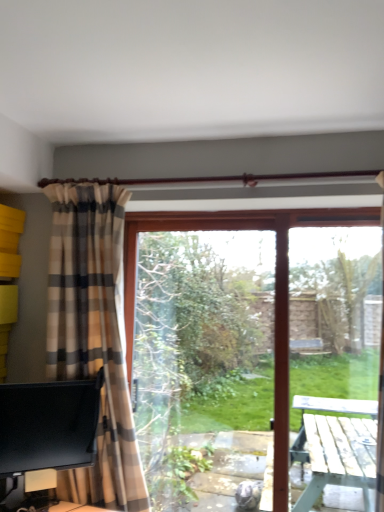
Question: Should I look upward or downward to see transparent glass screen door at right?

Choices:
 (A) down
 (B) up

Answer: (A)

Question: From the image's perspective, does plaid fabric curtain at left appear lower than transparent glass screen door at right?

Choices:
 (A) yes
 (B) no

Answer: (B)

Question: Does plaid fabric curtain at left appear on the right side of transparent glass screen door at right?

Choices:
 (A) no
 (B) yes

Answer: (A)

Question: Is plaid fabric curtain at left facing towards transparent glass screen door at right?

Choices:
 (A) no
 (B) yes

Answer: (A)

Question: Can you confirm if plaid fabric curtain at left is smaller than transparent glass screen door at right?

Choices:
 (A) no
 (B) yes

Answer: (A)

Question: Considering the relative positions of plaid fabric curtain at left and transparent glass screen door at right in the image provided, is plaid fabric curtain at left in front of transparent glass screen door at right?

Choices:
 (A) no
 (B) yes

Answer: (B)

Question: Would you say plaid fabric curtain at left contains transparent glass screen door at right?

Choices:
 (A) yes
 (B) no

Answer: (B)

Question: Does black glossy monitor at lower left have a greater width compared to transparent glass screen door at right?

Choices:
 (A) yes
 (B) no

Answer: (B)

Question: Considering the relative sizes of black glossy monitor at lower left and transparent glass screen door at right in the image provided, is black glossy monitor at lower left thinner than transparent glass screen door at right?

Choices:
 (A) no
 (B) yes

Answer: (B)

Question: Can you confirm if black glossy monitor at lower left is smaller than transparent glass screen door at right?

Choices:
 (A) yes
 (B) no

Answer: (A)

Question: Would you say black glossy monitor at lower left is outside transparent glass screen door at right?

Choices:
 (A) no
 (B) yes

Answer: (B)

Question: Does black glossy monitor at lower left appear on the left side of transparent glass screen door at right?

Choices:
 (A) no
 (B) yes

Answer: (B)

Question: Is black glossy monitor at lower left positioned with its back to transparent glass screen door at right?

Choices:
 (A) yes
 (B) no

Answer: (B)

Question: Can you confirm if transparent glass window screen at center is bigger than black glossy monitor at lower left?

Choices:
 (A) no
 (B) yes

Answer: (B)